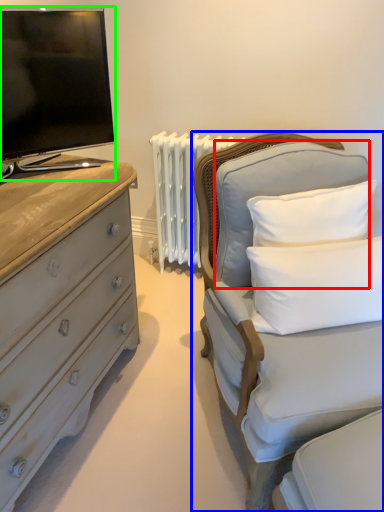
Question: Which is nearer to the pillow (highlighted by a red box)? furniture (highlighted by a blue box) or television (highlighted by a green box).

Choices:
 (A) furniture
 (B) television

Answer: (A)